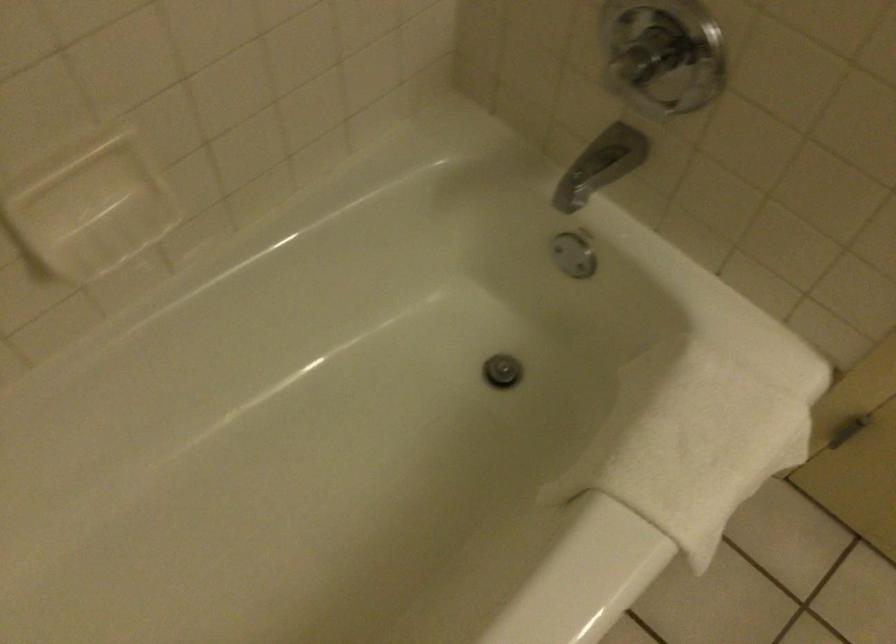
I want to click on silver shower handle, so click(x=661, y=55).